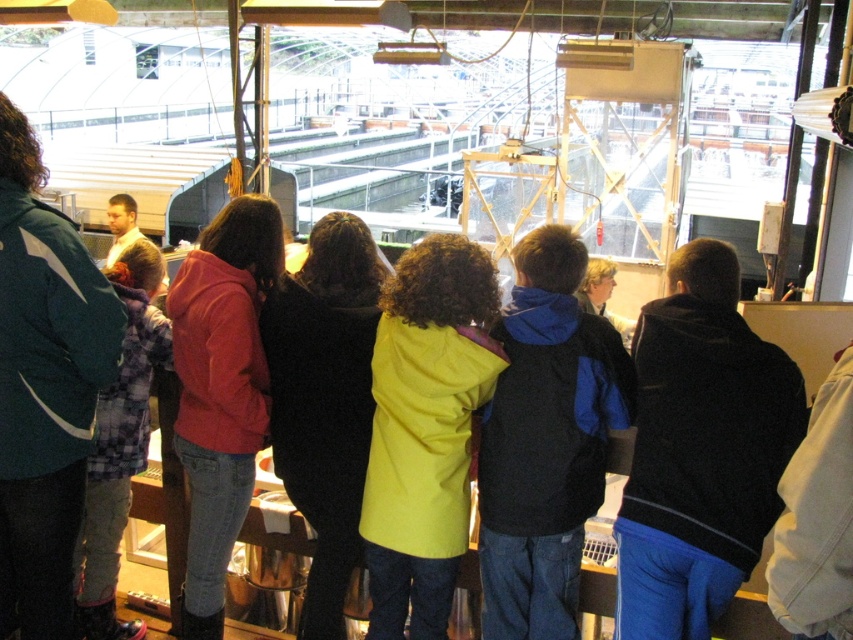
You are a photographer trying to capture both the yellow matte coat at center and the matte red jacket at center in the same frame. Since you want to ensure both are clearly visible, which clothing item should you focus on first to adjust your camera settings for size and detail?

The yellow matte coat at center is smaller than the matte red jacket at center, so you should focus on adjusting the camera settings for the smaller yellow matte coat at center first to ensure its details are captured clearly.

You are a photographer standing behind the group of people in the scene. You want to take a photo that captures both the blue fleece jacket at center and the yellow matte coat at center in the same frame. Given that your camera has a maximum focus range of 10 inches, will you be able to capture both subjects clearly?

The distance between the blue fleece jacket at center and the yellow matte coat at center is 9.92 inches, which is within the camera maximum focus range of 10 inches. Therefore, both subjects can be captured clearly in the same frame.